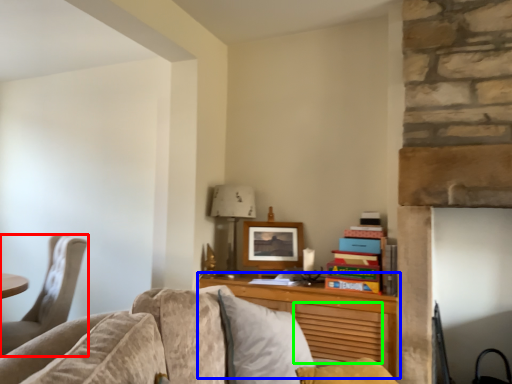
Question: Estimate the real-world distances between objects in this image. Which object is farther from chair (highlighted by a red box), desk (highlighted by a blue box) or drawer (highlighted by a green box)?

Choices:
 (A) desk
 (B) drawer

Answer: (B)